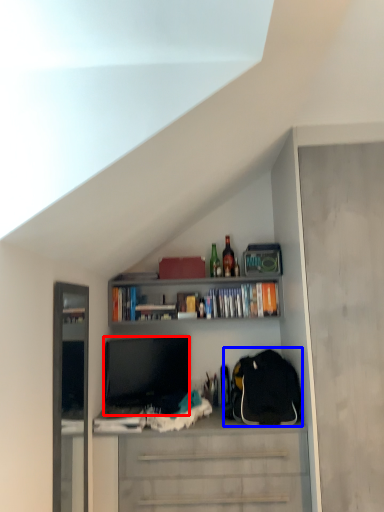
Question: Which object is further to the camera taking this photo, television (highlighted by a red box) or backpack (highlighted by a blue box)?

Choices:
 (A) television
 (B) backpack

Answer: (A)